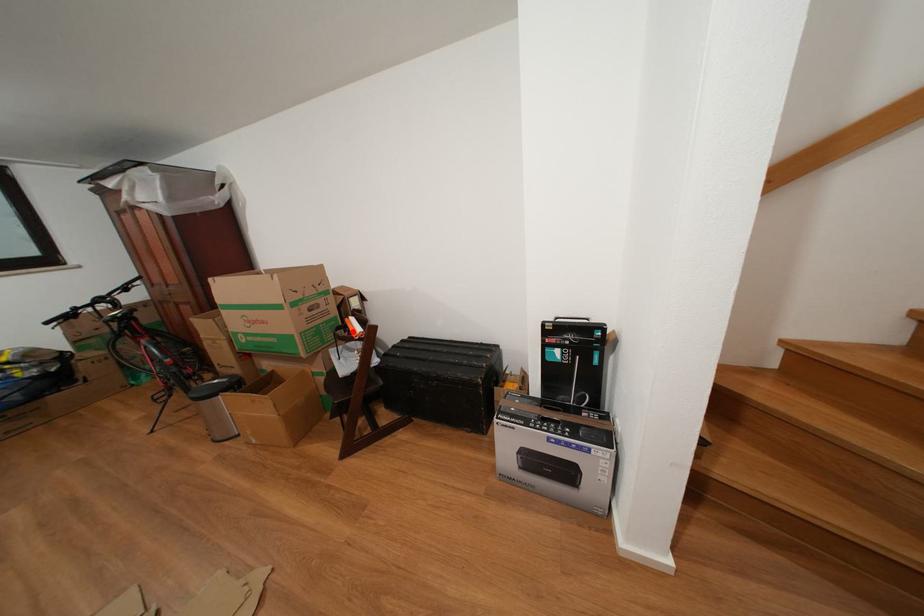
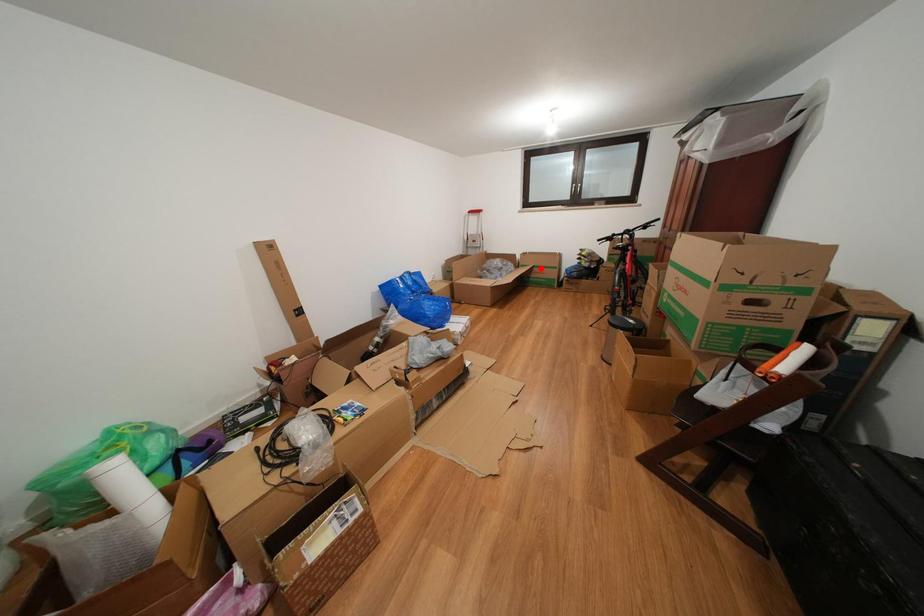
I am providing you with two images of the same scene from different viewpoints. A red point is marked on the first image and another point is marked on the second image. Does the point marked in image1 correspond to the same location as the one in image2?

No